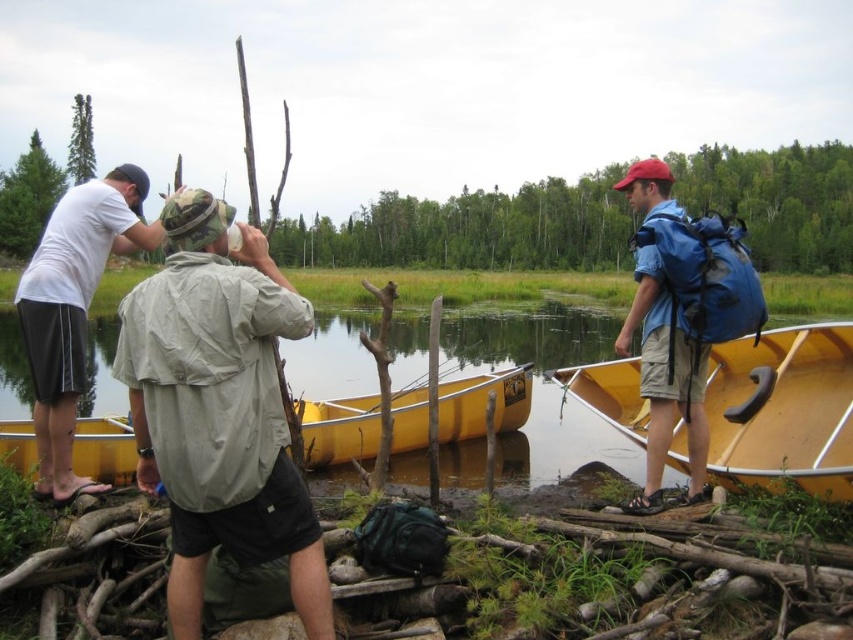
Question: Does yellow wood boat at right lie behind black rubber paddle at right?

Choices:
 (A) yes
 (B) no

Answer: (B)

Question: Is yellow wood boat at center wider than black rubber paddle at right?

Choices:
 (A) yes
 (B) no

Answer: (A)

Question: Can you confirm if khaki fabric shirt at center is positioned to the right of white matte shirt at left?

Choices:
 (A) yes
 (B) no

Answer: (A)

Question: Which point is closer to the camera?

Choices:
 (A) (329, 413)
 (B) (761, 385)

Answer: (B)

Question: Which point is farther to the camera?

Choices:
 (A) (769, 385)
 (B) (45, 460)
 (C) (663, 211)
 (D) (403, 380)

Answer: (D)

Question: Which of the following is the closest to the observer?

Choices:
 (A) (100, 474)
 (B) (791, 332)
 (C) (664, 166)
 (D) (82, 404)

Answer: (C)